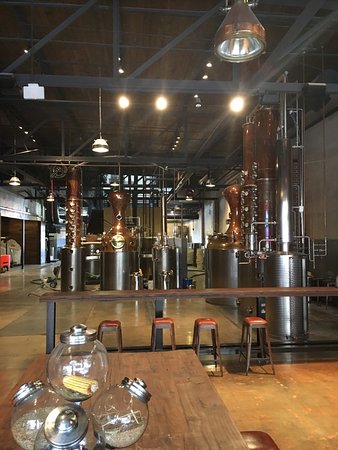
Find the location of `stools`. stools is located at coordinates (256, 321), (207, 322), (162, 322), (109, 325).